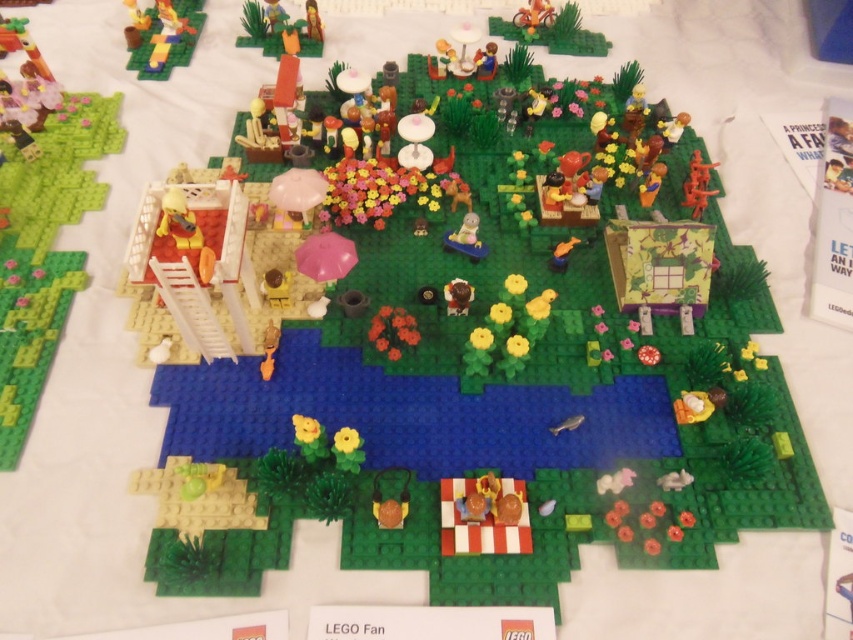
Question: Is matte yellow figure at upper left smaller than brown matte teddy bear at center?

Choices:
 (A) yes
 (B) no

Answer: (B)

Question: Does matte yellow figure at upper left have a larger size compared to brown matte teddy bear at center?

Choices:
 (A) no
 (B) yes

Answer: (B)

Question: Which object appears farthest from the camera in this image?

Choices:
 (A) brown matte teddy bear at center
 (B) matte yellow figure at upper left

Answer: (B)

Question: Which object appears farthest from the camera in this image?

Choices:
 (A) matte yellow figure at upper left
 (B) brown matte teddy bear at center

Answer: (A)

Question: Does matte yellow figure at upper left have a greater width compared to brown matte teddy bear at center?

Choices:
 (A) yes
 (B) no

Answer: (A)